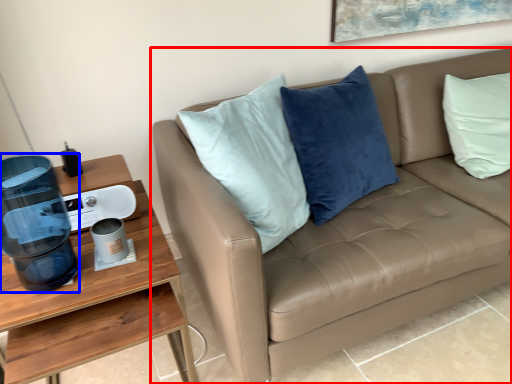
Question: Which object appears farthest to the camera in this image, studio couch (highlighted by a red box) or water cooler (highlighted by a blue box)?

Choices:
 (A) studio couch
 (B) water cooler

Answer: (B)